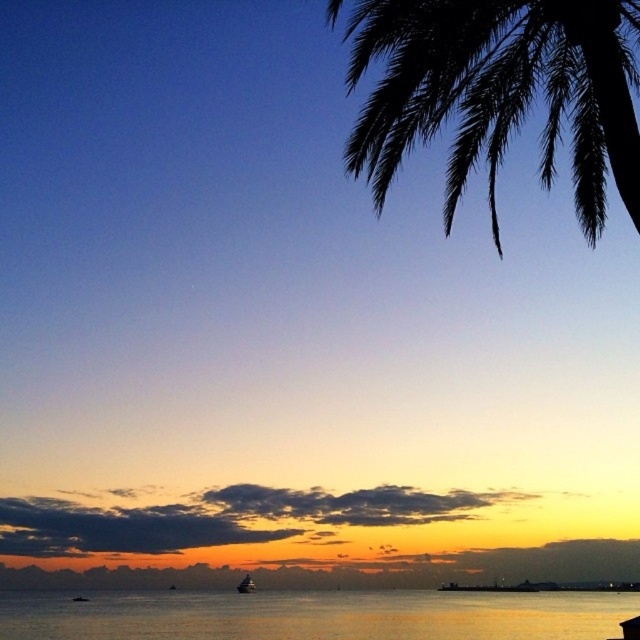
This screenshot has width=640, height=640. I want to click on silvery reflective water at center, so click(314, 616).

Does silvery reflective water at center have a greater width compared to shiny silver boat at lower center?

Yes.

Is point (490, 593) behind point (250, 586)?

Yes, point (490, 593) is farther from viewer.

This screenshot has width=640, height=640. What are the coordinates of `silvery reflective water at center` in the screenshot? It's located at (314, 616).

Is silvery reflective water at center below smooth orange sky at lower center?

No.

Who is taller, silvery reflective water at center or smooth orange sky at lower center?

silvery reflective water at center is taller.

Which is in front, point (144, 632) or point (577, 541)?

Point (144, 632) is in front.

Identify the location of silvery reflective water at center. This screenshot has height=640, width=640. (314, 616).

Is silhouette leafy branch at upper right above smooth orange sky at lower center?

Indeed, silhouette leafy branch at upper right is positioned over smooth orange sky at lower center.

Measure the distance from silhouette leafy branch at upper right to smooth orange sky at lower center.

The distance of silhouette leafy branch at upper right from smooth orange sky at lower center is 211.53 feet.

Which is in front, point (609, 150) or point (529, 557)?

Positioned in front is point (609, 150).

Locate an element on the screen. silhouette leafy branch at upper right is located at coordinates (499, 92).